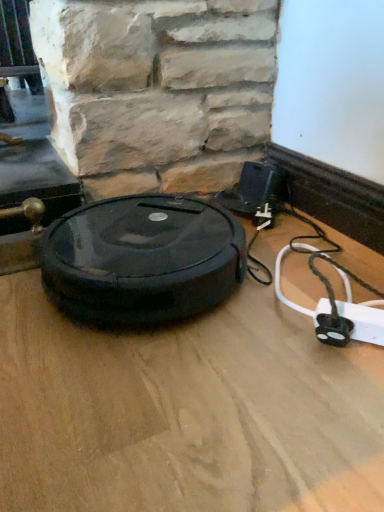
Question: Is wooden floor at center surrounded by black rubber robot vacuum cleaner at center?

Choices:
 (A) yes
 (B) no

Answer: (B)

Question: From the image's perspective, is black rubber robot vacuum cleaner at center under wooden floor at center?

Choices:
 (A) no
 (B) yes

Answer: (B)

Question: Considering the relative sizes of black rubber robot vacuum cleaner at center and wooden floor at center in the image provided, is black rubber robot vacuum cleaner at center thinner than wooden floor at center?

Choices:
 (A) no
 (B) yes

Answer: (B)

Question: Does black rubber robot vacuum cleaner at center appear on the right side of wooden floor at center?

Choices:
 (A) no
 (B) yes

Answer: (B)

Question: From a real-world perspective, is black rubber robot vacuum cleaner at center below wooden floor at center?

Choices:
 (A) yes
 (B) no

Answer: (B)

Question: Is black rubber robot vacuum cleaner at center positioned with its back to wooden floor at center?

Choices:
 (A) no
 (B) yes

Answer: (A)

Question: Considering the relative sizes of white plastic extension cord at lower right and black rubber robot vacuum cleaner at center in the image provided, is white plastic extension cord at lower right bigger than black rubber robot vacuum cleaner at center?

Choices:
 (A) no
 (B) yes

Answer: (A)

Question: Is white plastic extension cord at lower right touching black rubber robot vacuum cleaner at center?

Choices:
 (A) yes
 (B) no

Answer: (B)

Question: Is white plastic extension cord at lower right oriented towards black rubber robot vacuum cleaner at center?

Choices:
 (A) yes
 (B) no

Answer: (B)

Question: From a real-world perspective, is white plastic extension cord at lower right under black rubber robot vacuum cleaner at center?

Choices:
 (A) no
 (B) yes

Answer: (B)

Question: Considering the relative sizes of white plastic extension cord at lower right and black rubber robot vacuum cleaner at center in the image provided, is white plastic extension cord at lower right wider than black rubber robot vacuum cleaner at center?

Choices:
 (A) yes
 (B) no

Answer: (B)

Question: Would you say white plastic extension cord at lower right is outside black rubber robot vacuum cleaner at center?

Choices:
 (A) yes
 (B) no

Answer: (A)

Question: From a real-world perspective, is black rubber robot vacuum cleaner at center physically above white plastic extension cord at lower right?

Choices:
 (A) no
 (B) yes

Answer: (B)